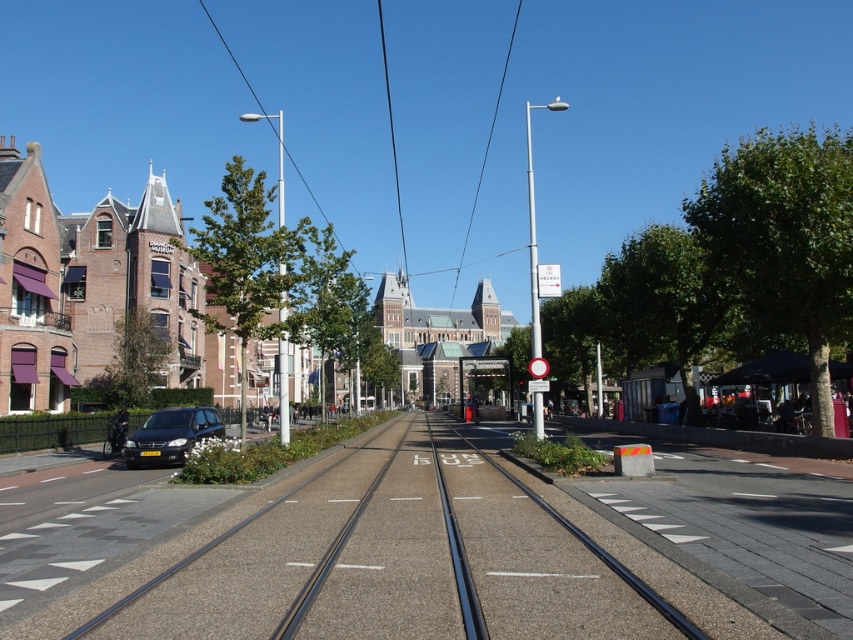
You are standing at the edge of the road and want to cross to the other side. The tram tracks are in the center. If you start walking straight ahead towards the black asphalt track at center, how far will you have to walk before reaching it?

The black asphalt track at center is 5.19 meters away from the camera, so you would need to walk approximately 5.19 meters to reach it.

You are a delivery driver who needs to park your vehicle, which is the same size as the satin black car at lower left, near the black asphalt track at center. Is there enough space to park your car without overlapping the track?

The black asphalt track at center is larger in size than the satin black car at lower left, so there is sufficient space to park your car near the track without overlapping it.